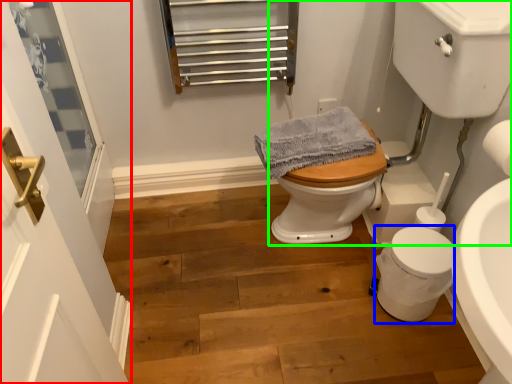
Question: Considering the real-world distances, which object is farthest from screen door (highlighted by a red box)? porcelain (highlighted by a blue box) or sink (highlighted by a green box)?

Choices:
 (A) porcelain
 (B) sink

Answer: (B)